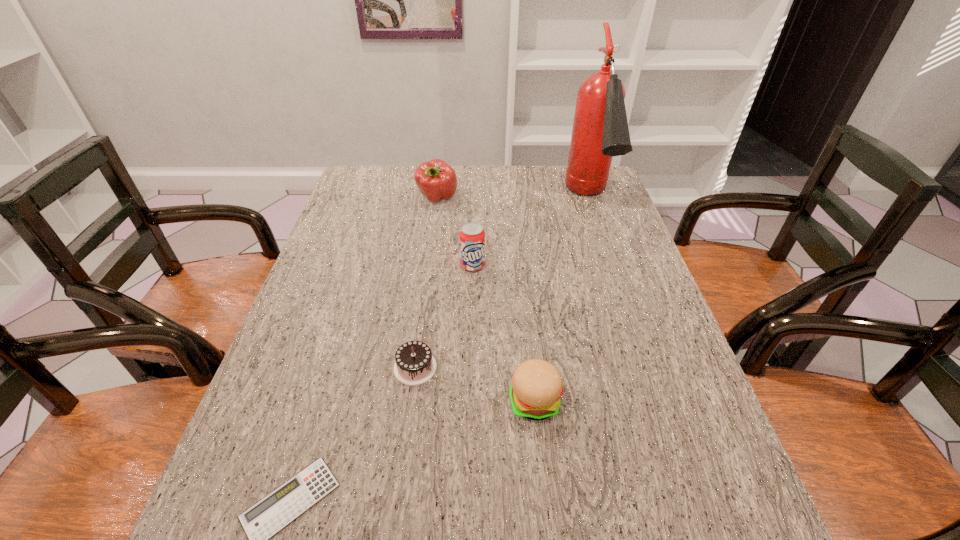
The image size is (960, 540). What are the coordinates of `vacant region that satisfies the following two spatial constraints: 1. on the surface of the third farthest object; 2. on the left side of the fifth object from left to right` in the screenshot? It's located at (470, 401).